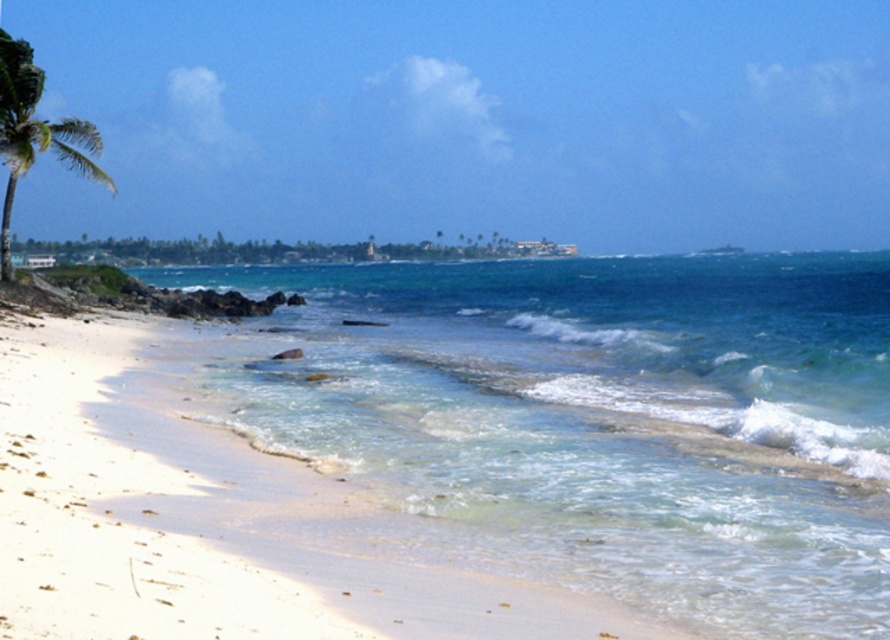
Question: Does clear blue water at center appear on the right side of green leafy palm tree at left?

Choices:
 (A) no
 (B) yes

Answer: (B)

Question: Which point is farther from the camera taking this photo?

Choices:
 (A) [10, 60]
 (B) [605, 376]

Answer: (A)

Question: Does clear blue water at center have a larger size compared to green leafy palm tree at left?

Choices:
 (A) yes
 (B) no

Answer: (B)

Question: Which object appears farthest from the camera in this image?

Choices:
 (A) clear blue water at center
 (B) green leafy palm tree at left

Answer: (B)

Question: Can you confirm if clear blue water at center is positioned to the right of green leafy palm tree at left?

Choices:
 (A) no
 (B) yes

Answer: (B)